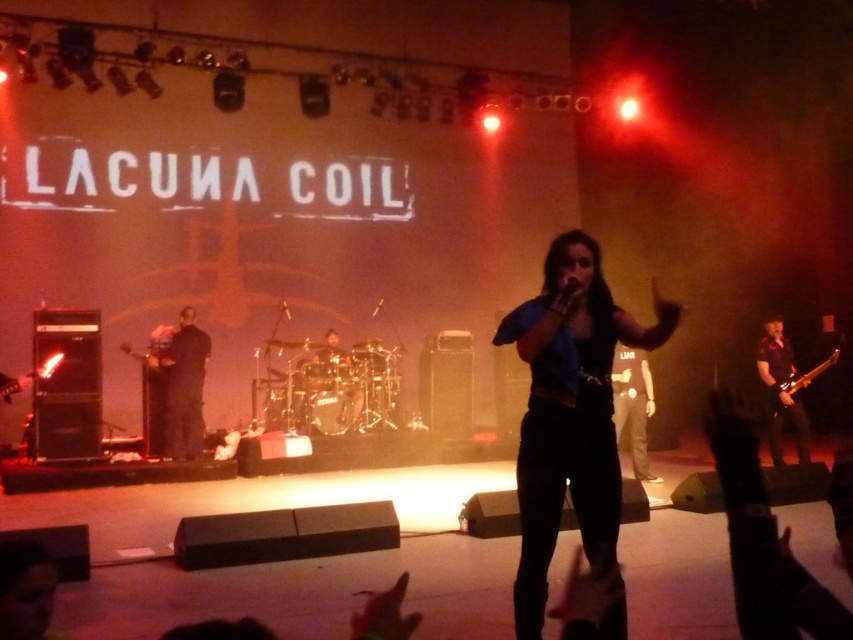
Measure the distance between point (180, 358) and camera.

Point (180, 358) is 25.77 feet from camera.

The width and height of the screenshot is (853, 640). Describe the element at coordinates (184, 385) in the screenshot. I see `black matte jacket at left` at that location.

Is point (180, 380) in front of point (642, 461)?

No, (180, 380) is behind (642, 461).

In order to click on black matte jacket at left in this screenshot , I will do `click(184, 385)`.

Measure the distance from black matte jacket at left to shiny metallic guitar at right.

black matte jacket at left and shiny metallic guitar at right are 5.95 meters apart from each other.

Which is more to the right, black matte jacket at left or shiny metallic guitar at right?

From the viewer's perspective, shiny metallic guitar at right appears more on the right side.

Locate an element on the screen. The height and width of the screenshot is (640, 853). black matte jacket at left is located at coordinates (x=184, y=385).

The image size is (853, 640). What are the coordinates of `black matte jacket at left` in the screenshot? It's located at (184, 385).

Who is lower down, shiny black guitar at right or shiny metallic guitar at right?

shiny black guitar at right

Is shiny black guitar at right to the left of shiny metallic guitar at right from the viewer's perspective?

Indeed, shiny black guitar at right is positioned on the left side of shiny metallic guitar at right.

Does point (779, 337) lie behind point (828, 356)?

No, it is in front of (828, 356).

Locate an element on the screen. The image size is (853, 640). shiny black guitar at right is located at coordinates (780, 392).